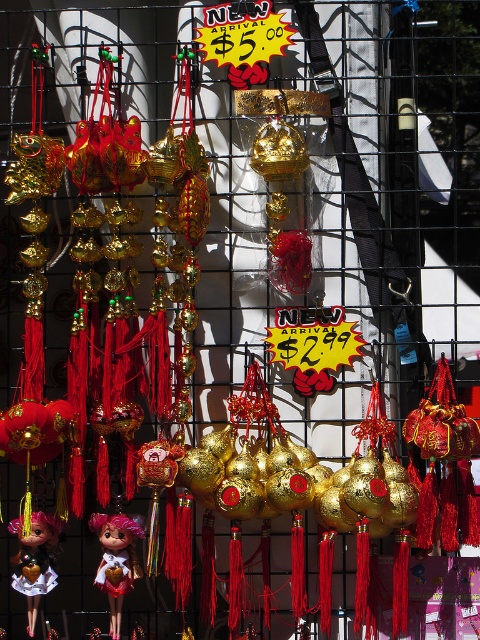
Question: Does matte pink doll at center come behind matte pink doll at lower left?

Choices:
 (A) yes
 (B) no

Answer: (A)

Question: Which of the following is the farthest from the observer?

Choices:
 (A) matte pink doll at lower left
 (B) matte pink doll at center

Answer: (B)

Question: Is matte pink doll at center to the left of matte pink doll at lower left from the viewer's perspective?

Choices:
 (A) no
 (B) yes

Answer: (A)

Question: Does matte pink doll at center appear over matte pink doll at lower left?

Choices:
 (A) yes
 (B) no

Answer: (B)

Question: Which of the following is the farthest from the observer?

Choices:
 (A) (122, 561)
 (B) (40, 582)

Answer: (B)